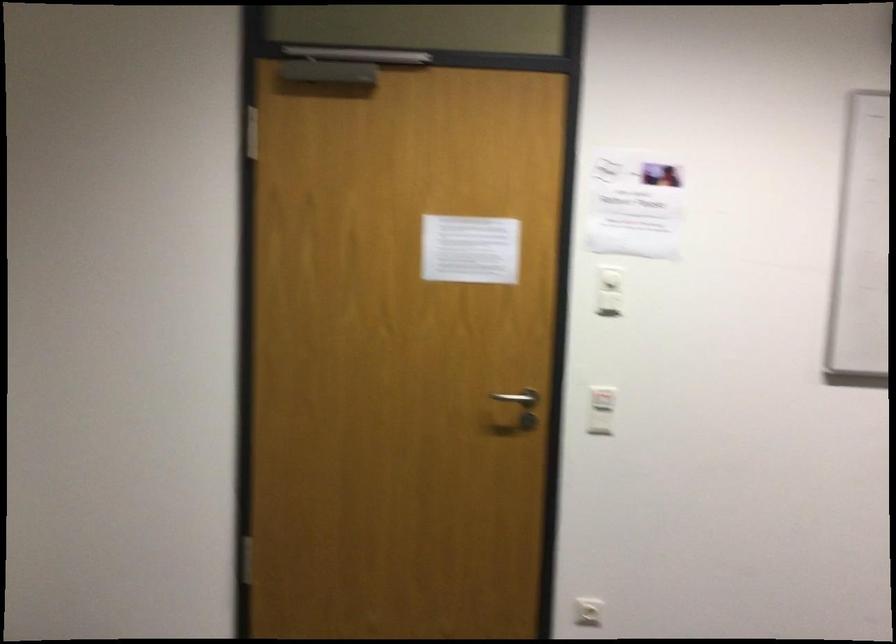
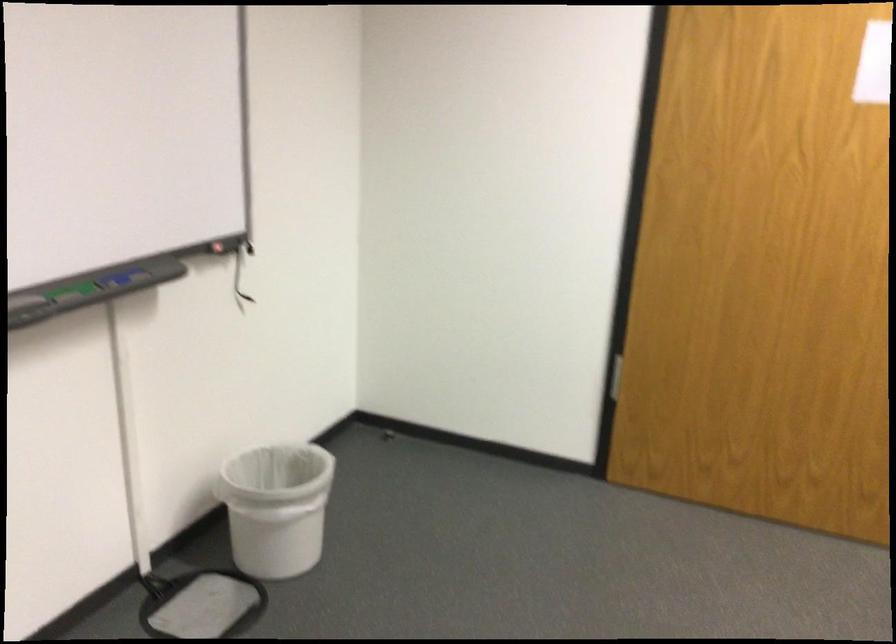
Question: The camera is either moving clockwise (left) or counter-clockwise (right) around the object. The first image is from the beginning of the video and the second image is from the end. Is the camera moving left or right when shooting the video?

Choices:
 (A) Left
 (B) Right

Answer: (B)